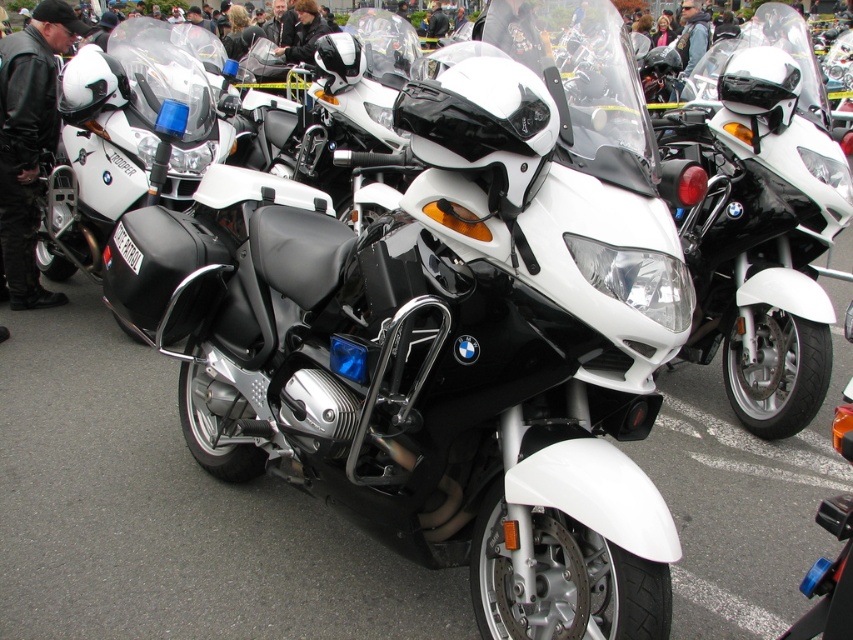
Based on the photo, can you confirm if white matte motorcycle at center is shorter than leather jacket at center?

No, white matte motorcycle at center is not shorter than leather jacket at center.

Can you confirm if white matte motorcycle at center is wider than leather jacket at center?

Indeed, white matte motorcycle at center has a greater width compared to leather jacket at center.

Between point (763, 426) and point (36, 49), which one is positioned in front?

Point (763, 426) is in front.

Locate an element on the screen. white matte motorcycle at center is located at coordinates (763, 221).

Is white matte/black textured motorcycle at center bigger than black leather jacket at center?

Indeed, white matte/black textured motorcycle at center has a larger size compared to black leather jacket at center.

From the picture: Measure the distance from white matte/black textured motorcycle at center to black leather jacket at center.

17.78 feet

Which is in front, point (225, 392) or point (305, 26)?

Point (225, 392) is more forward.

Identify the location of white matte/black textured motorcycle at center. The width and height of the screenshot is (853, 640). (450, 349).

Which is in front, point (234, 477) or point (819, 170)?

Point (234, 477) is more forward.

Between point (433, 522) and point (778, 428), which one is positioned behind?

Point (778, 428)

The width and height of the screenshot is (853, 640). In order to click on white matte/black textured motorcycle at center in this screenshot , I will do `click(450, 349)`.